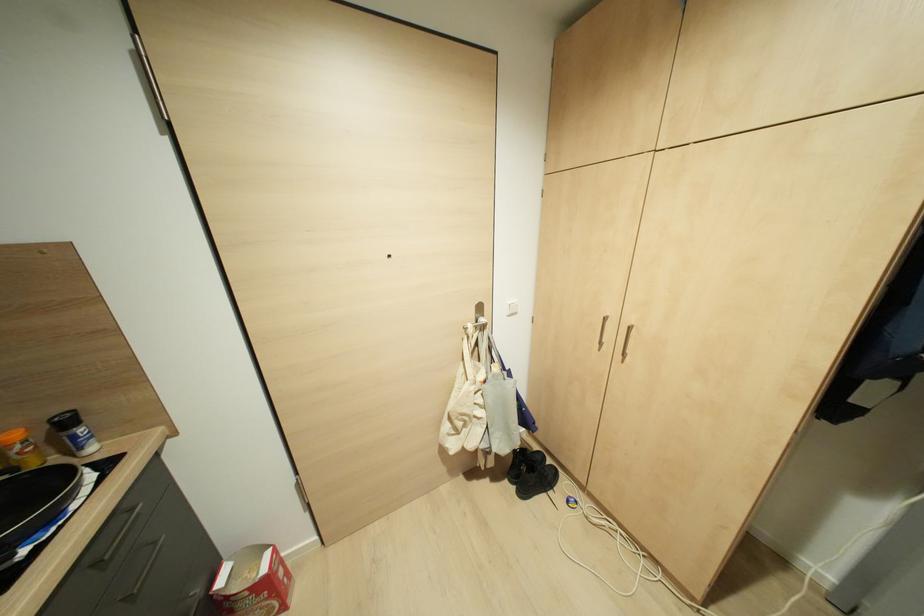
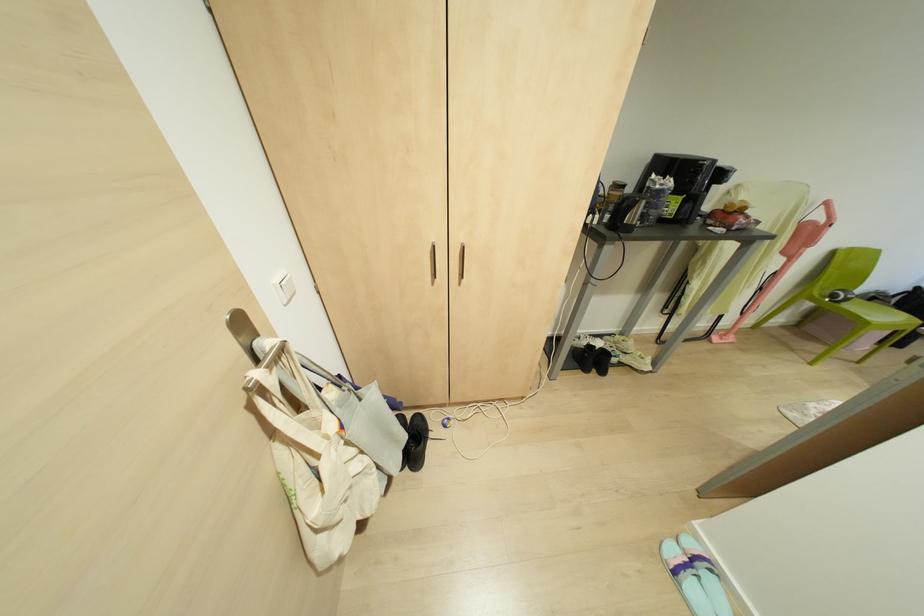
In the second image, find the point that corresponds to (492,339) in the first image.

(305, 362)